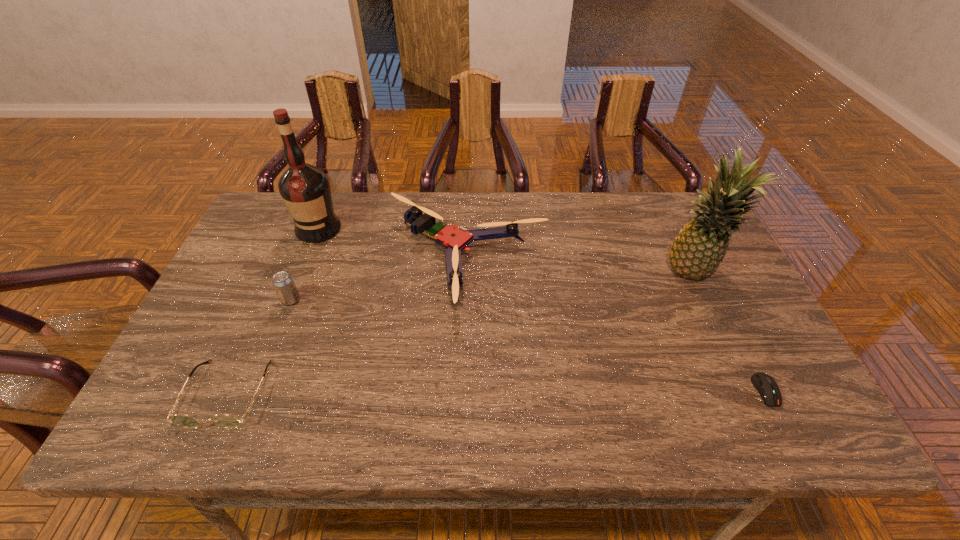
Locate an element on the screen. The image size is (960, 540). object at the near right corner is located at coordinates (767, 387).

This screenshot has height=540, width=960. In order to click on vacant space at the far edge of the desktop in this screenshot , I will do `click(595, 221)`.

Identify the location of vacant space at the near edge of the desktop. (638, 406).

This screenshot has height=540, width=960. Identify the location of free point at the right edge. (782, 370).

Locate an element on the screen. The height and width of the screenshot is (540, 960). vacant space at the near right corner is located at coordinates (795, 411).

Where is `free spot between the drone and the spectacles`? free spot between the drone and the spectacles is located at coordinates pos(348,328).

You are a GUI agent. You are given a task and a screenshot of the screen. Output one action in this format:
    pyautogui.click(x=<x>, y=<y>)
    Task: Click on the blank region between the shortest object and the second shortest object
    The height and width of the screenshot is (540, 960).
    Given the screenshot: What is the action you would take?
    pyautogui.click(x=496, y=392)

Where is `unoccupied position between the spectacles and the computer equipment`? The width and height of the screenshot is (960, 540). unoccupied position between the spectacles and the computer equipment is located at coordinates (496, 392).

Identify the location of blank region between the fourth object from left to right and the beer can. The image size is (960, 540). (379, 282).

Identify the location of free space between the computer equipment and the beer can. This screenshot has width=960, height=540. (528, 345).